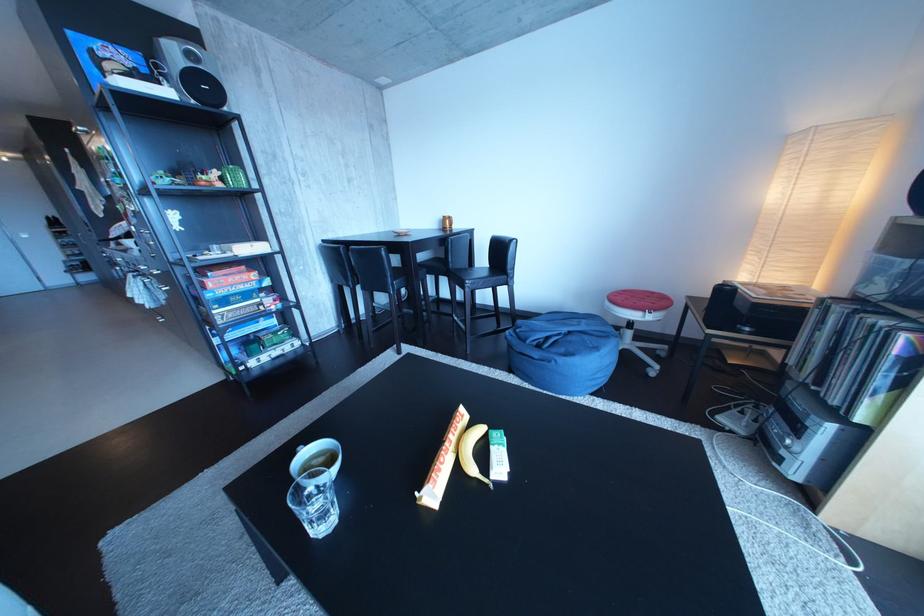
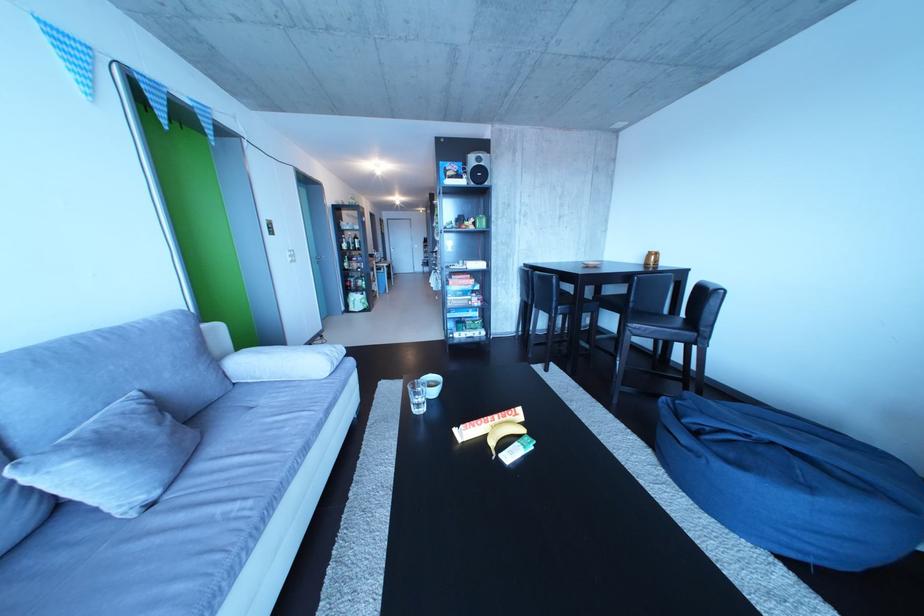
Question: The camera is either moving clockwise (left) or counter-clockwise (right) around the object. The first image is from the beginning of the video and the second image is from the end. Is the camera moving left or right when shooting the video?

Choices:
 (A) Left
 (B) Right

Answer: (B)